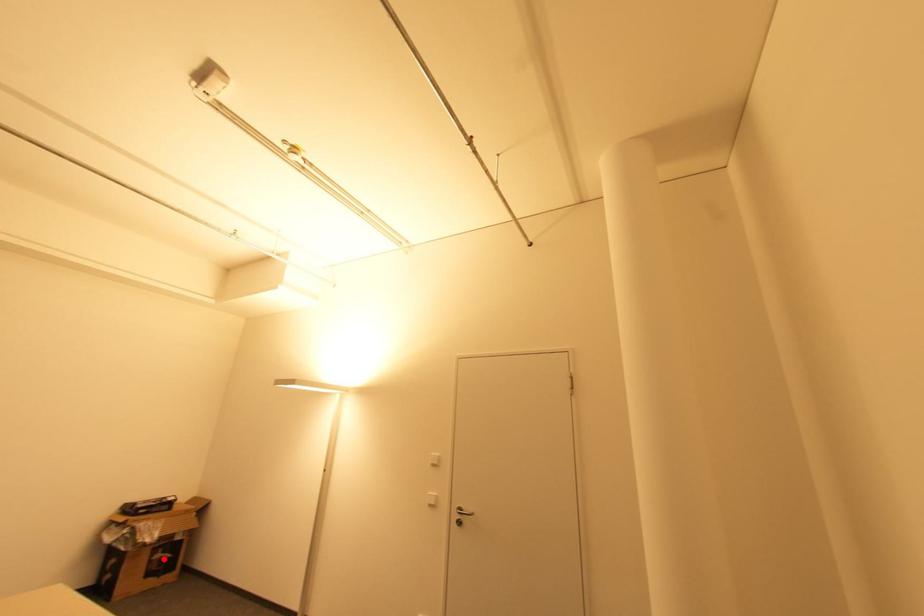
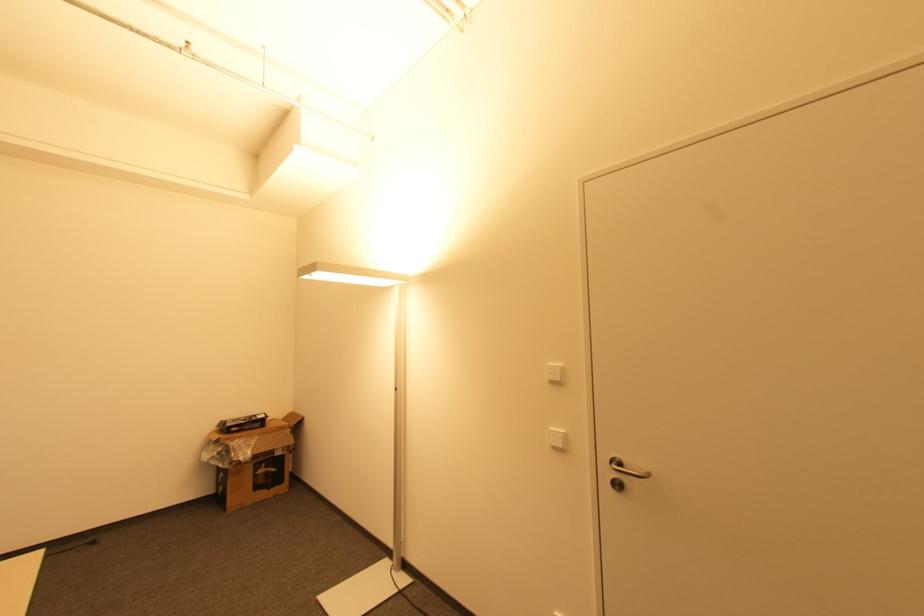
Question: I am providing you with two images of the same scene from different viewpoints. Given a red point in image1, look at the same physical point in image2. Is it:

Choices:
 (A) Closer to the viewpoint
 (B) Farther from the viewpoint

Answer: (A)